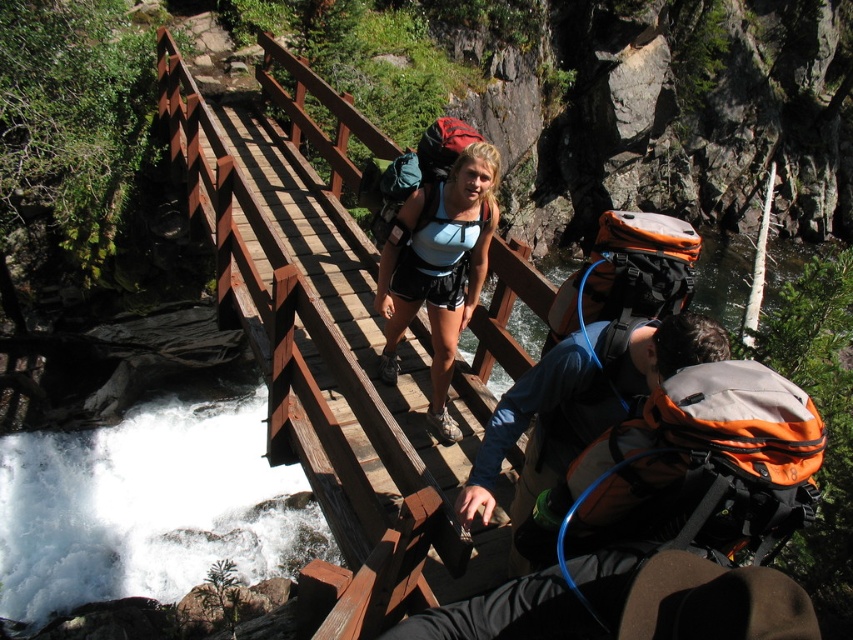
Can you confirm if brown wooden bridge at center is thinner than orange fabric backpack at center?

Yes.

From the picture: Measure the distance from brown wooden bridge at center to orange fabric backpack at center.

3.48 meters

The image size is (853, 640). What are the coordinates of `brown wooden bridge at center` in the screenshot? It's located at (326, 340).

Who is positioned more to the right, brown wooden bridge at center or matte blue fabric backpack at center?

matte blue fabric backpack at center

Between brown wooden bridge at center and matte blue fabric backpack at center, which one has more height?

matte blue fabric backpack at center is taller.

Find the location of `brown wooden bridge at center`. brown wooden bridge at center is located at coordinates pos(326,340).

Does orange fabric backpack at center appear under matte blue fabric backpack at center?

Yes.

Consider the image. Does orange fabric backpack at center have a larger size compared to matte blue fabric backpack at center?

Incorrect, orange fabric backpack at center is not larger than matte blue fabric backpack at center.

Does point (639, 358) come behind point (456, 324)?

No, it is in front of (456, 324).

Locate an element on the screen. The image size is (853, 640). orange fabric backpack at center is located at coordinates (579, 401).